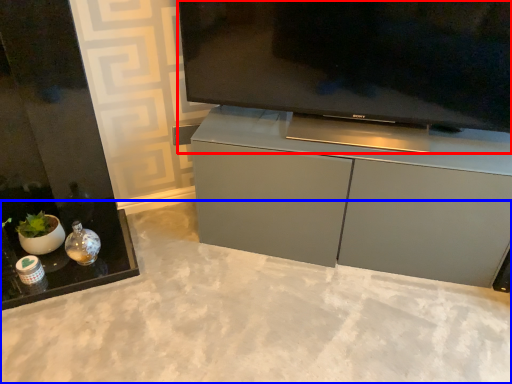
Question: Which point is closer to the camera, television (highlighted by a red box) or concrete (highlighted by a blue box)?

Choices:
 (A) television
 (B) concrete

Answer: (B)